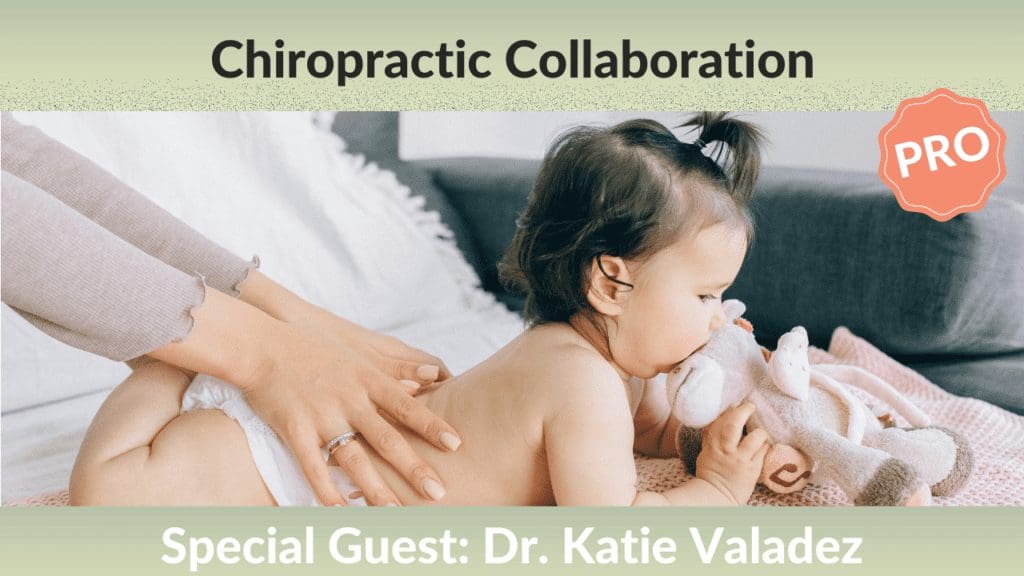
Find the location of a particular element. This screenshot has width=1024, height=576. pillow is located at coordinates (264, 200), (36, 363).